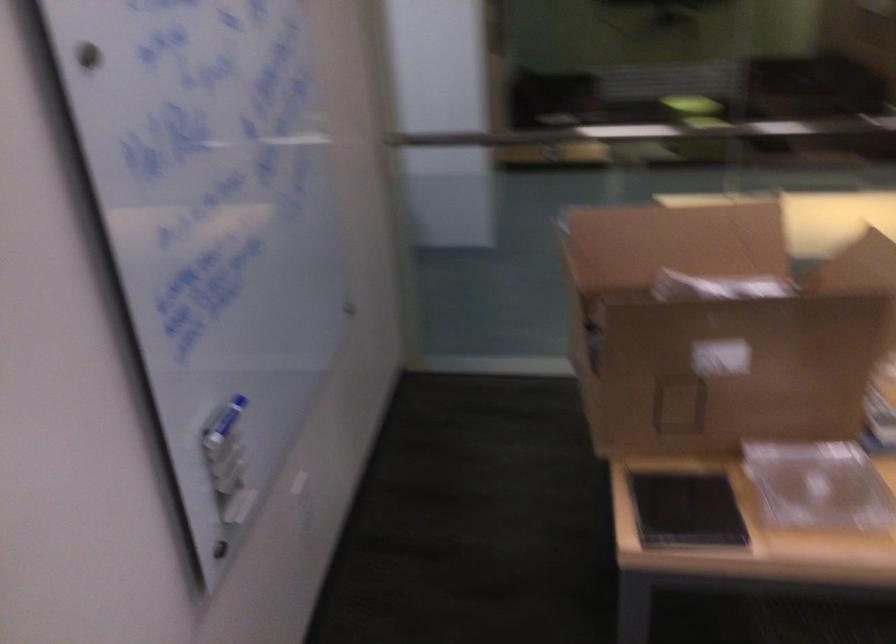
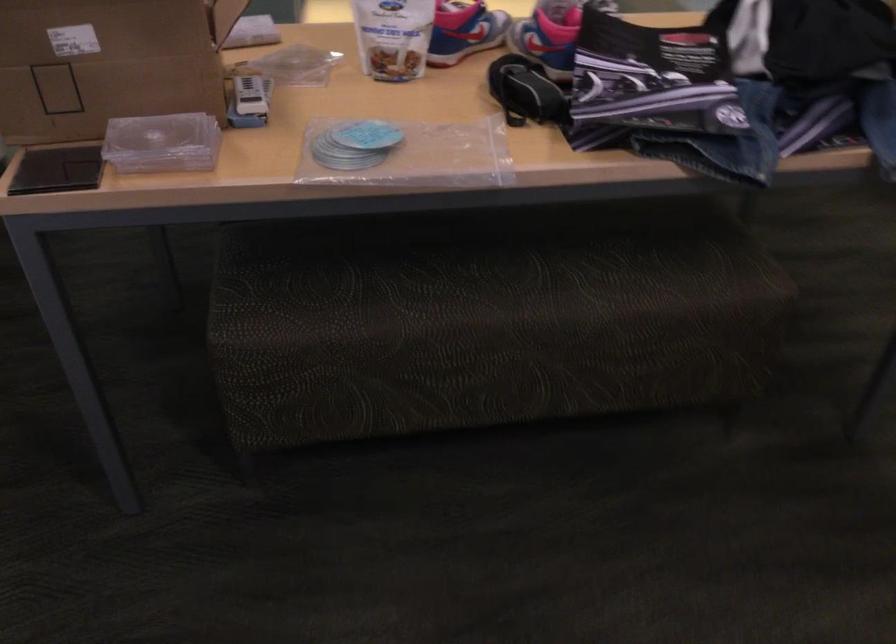
The point at (719, 391) is marked in the first image. Where is the corresponding point in the second image?

(107, 62)